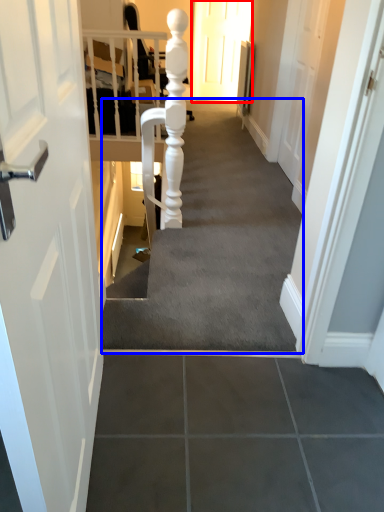
Question: Which point is further to the camera, door (highlighted by a red box) or stairwell (highlighted by a blue box)?

Choices:
 (A) door
 (B) stairwell

Answer: (A)